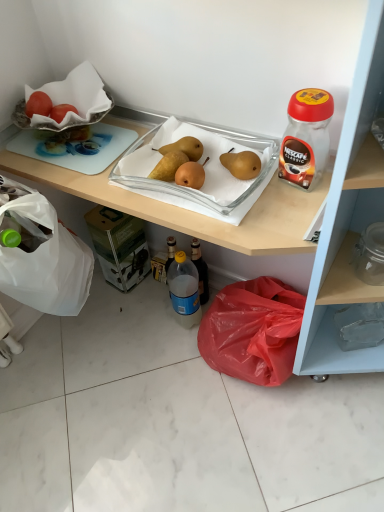
Identify the location of vacant area located to the right-hand side of smooth red tomato at upper left. The height and width of the screenshot is (512, 384). (109, 132).